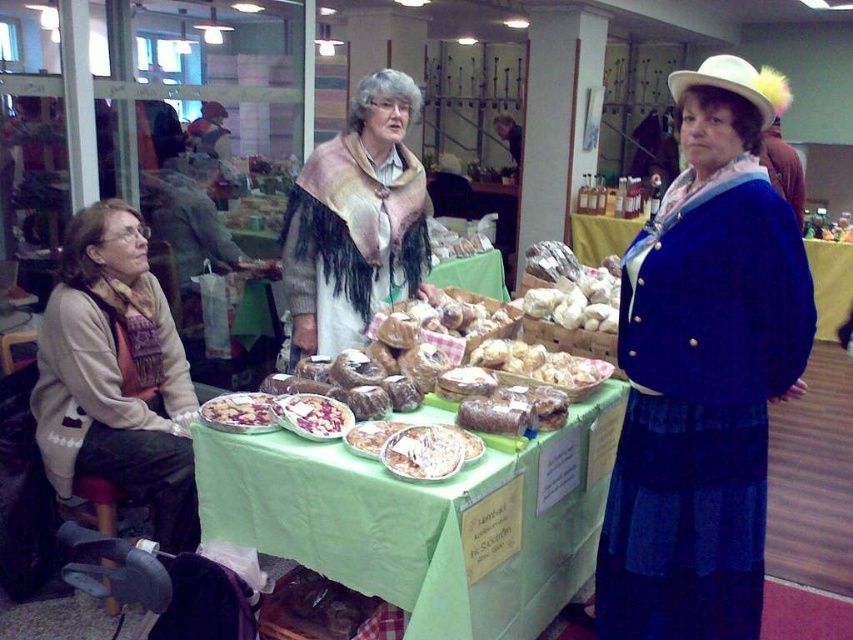
You are at a community event and see two items on a table. The items are bread at center and white creamy cake at center. Which one is positioned to the right of the other?

The bread at center is to the right of the white creamy cake at center.

What is the object located at the coordinates point (357, 221) in the image?

The beige fringed shawl at center is located at point (357, 221).